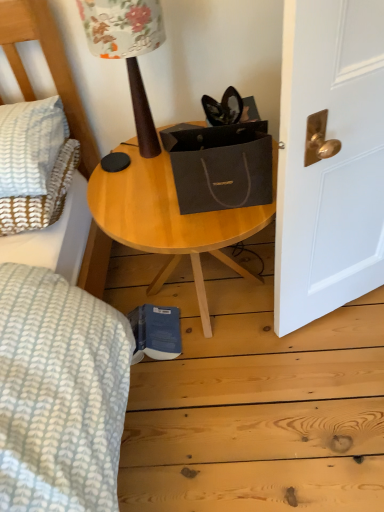
Question: Is wooden table lamp at upper center positioned behind wooden table at center?

Choices:
 (A) no
 (B) yes

Answer: (A)

Question: Is wooden table lamp at upper center oriented away from wooden table at center?

Choices:
 (A) yes
 (B) no

Answer: (B)

Question: Is wooden table lamp at upper center taller than wooden table at center?

Choices:
 (A) yes
 (B) no

Answer: (B)

Question: Considering the relative sizes of wooden table lamp at upper center and wooden table at center in the image provided, is wooden table lamp at upper center smaller than wooden table at center?

Choices:
 (A) no
 (B) yes

Answer: (B)

Question: Does wooden table lamp at upper center lie in front of wooden table at center?

Choices:
 (A) no
 (B) yes

Answer: (B)

Question: In the image, is wooden table lamp at upper center positioned in front of or behind white textured pillow at left?

Choices:
 (A) front
 (B) behind

Answer: (A)

Question: Would you say wooden table lamp at upper center is inside or outside white textured pillow at left?

Choices:
 (A) outside
 (B) inside

Answer: (A)

Question: Is wooden table lamp at upper center taller or shorter than white textured pillow at left?

Choices:
 (A) short
 (B) tall

Answer: (B)

Question: Considering the positions of wooden table lamp at upper center and white textured pillow at left in the image, is wooden table lamp at upper center wider or thinner than white textured pillow at left?

Choices:
 (A) thin
 (B) wide

Answer: (A)

Question: Visually, is white textured pillow at left positioned to the left or to the right of wooden table lamp at upper center?

Choices:
 (A) left
 (B) right

Answer: (A)

Question: From a real-world perspective, relative to wooden table lamp at upper center, is white textured pillow at left vertically above or below?

Choices:
 (A) below
 (B) above

Answer: (A)

Question: Considering the positions of white textured pillow at left and wooden table lamp at upper center in the image, is white textured pillow at left bigger or smaller than wooden table lamp at upper center?

Choices:
 (A) big
 (B) small

Answer: (B)

Question: In terms of width, does white textured pillow at left look wider or thinner when compared to wooden table lamp at upper center?

Choices:
 (A) thin
 (B) wide

Answer: (B)

Question: Considering the relative positions of white textured pillow at left and wooden table at center in the image provided, is white textured pillow at left to the left or to the right of wooden table at center?

Choices:
 (A) right
 (B) left

Answer: (B)

Question: From the image's perspective, is white textured pillow at left located above or below wooden table at center?

Choices:
 (A) below
 (B) above

Answer: (B)